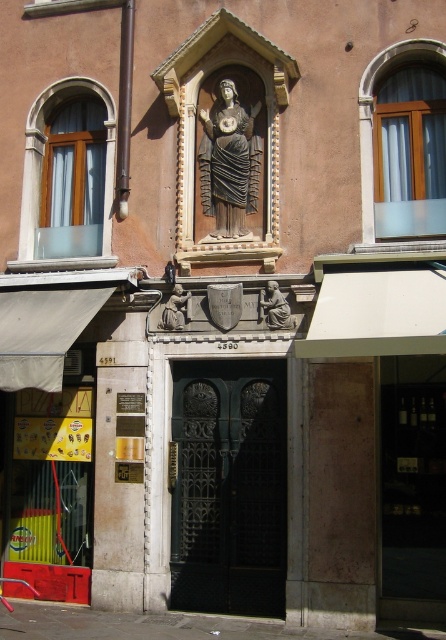
Question: Which object is farther from the camera taking this photo?

Choices:
 (A) matte gray stone statue at center
 (B) dark gray stone statue at center

Answer: (B)

Question: Which point is closer to the camera?

Choices:
 (A) (283, 300)
 (B) (222, 161)

Answer: (A)

Question: Is dark gray stone statue at center wider than matte stone statue at center?

Choices:
 (A) no
 (B) yes

Answer: (B)

Question: Is dark gray stone statue at center smaller than matte stone statue at center?

Choices:
 (A) yes
 (B) no

Answer: (B)

Question: Can you confirm if matte gray stone statue at center is wider than matte stone statue at center?

Choices:
 (A) yes
 (B) no

Answer: (A)

Question: Which of the following is the closest to the observer?

Choices:
 (A) dark gray stone statue at center
 (B) matte gray stone statue at center
 (C) matte stone statue at center

Answer: (B)